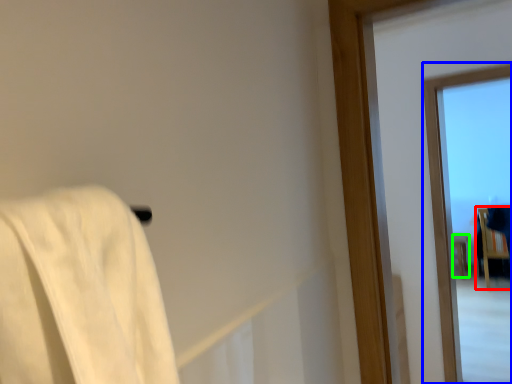
Question: Which object is positioned farthest from furniture (highlighted by a red box)? Select from window (highlighted by a blue box) and furniture (highlighted by a green box).

Choices:
 (A) window
 (B) furniture

Answer: (A)